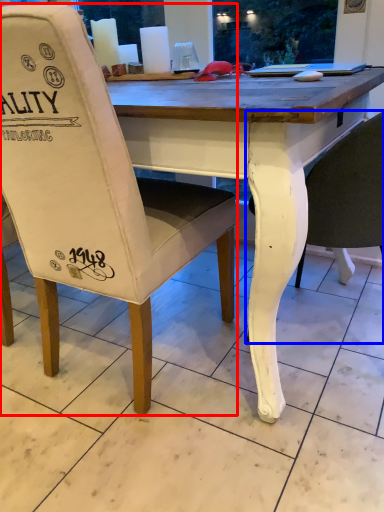
Question: Which of the following is the farthest to the observer, chair (highlighted by a red box) or chair (highlighted by a blue box)?

Choices:
 (A) chair
 (B) chair

Answer: (B)